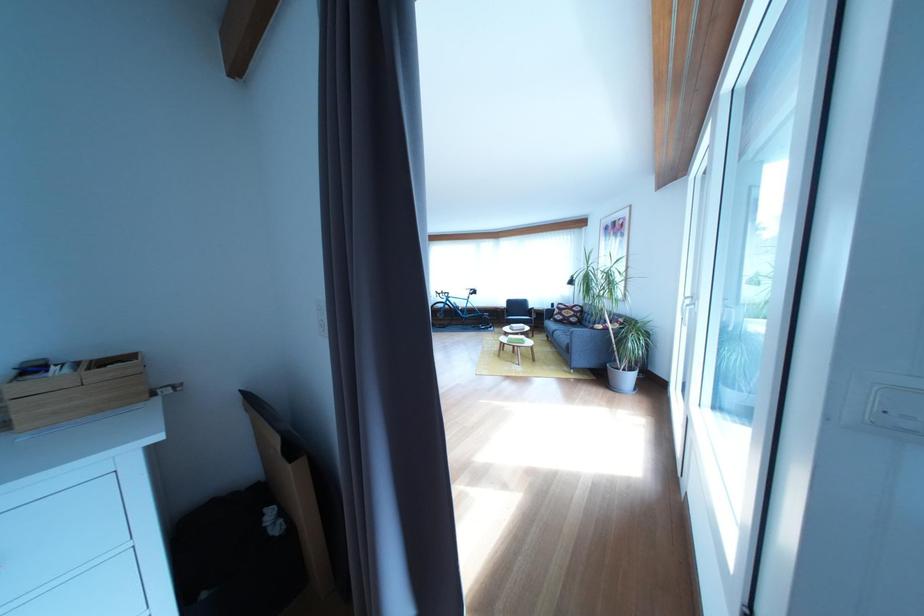
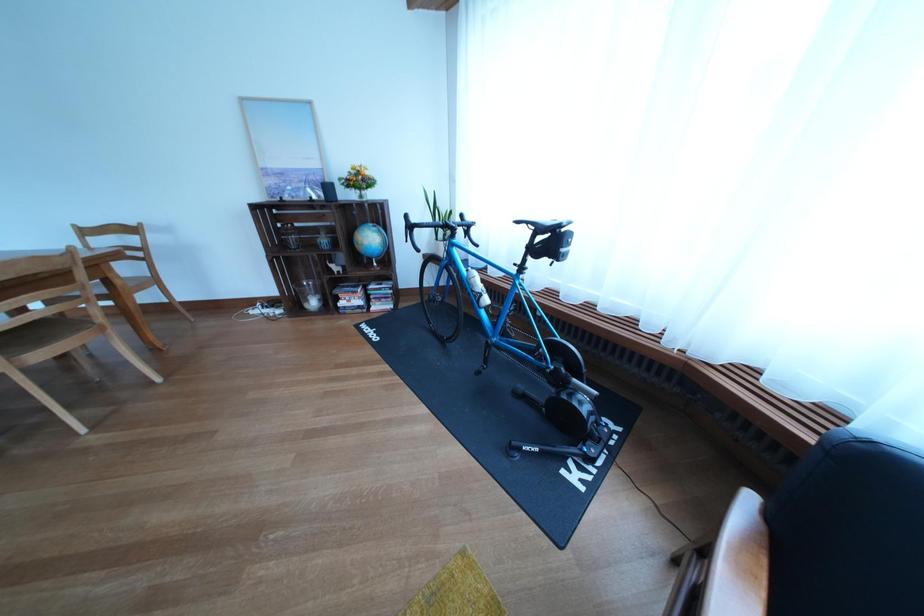
The point at (487,298) is marked in the first image. Where is the corresponding point in the second image?

(563, 248)